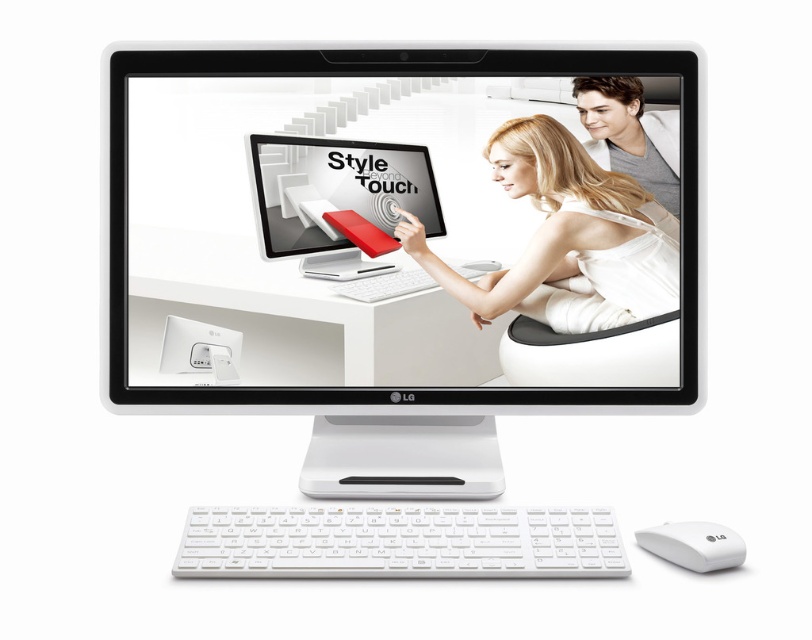
Describe the element at coordinates (400, 228) in the screenshot. I see `white glossy monitor at center` at that location.

Which is behind, point (417, 141) or point (433, 212)?

The point (433, 212) is behind.

The width and height of the screenshot is (812, 640). I want to click on white glossy monitor at center, so click(400, 228).

Does white glossy monitor at center have a greater width compared to smooth white shirt at upper right?

Yes.

Is white glossy monitor at center smaller than smooth white shirt at upper right?

No, white glossy monitor at center is not smaller than smooth white shirt at upper right.

Image resolution: width=812 pixels, height=640 pixels. I want to click on white glossy monitor at center, so click(400, 228).

Does white plastic keyboard at lower center have a larger size compared to smooth white shirt at upper right?

Yes.

Who is positioned more to the left, white plastic keyboard at lower center or smooth white shirt at upper right?

white plastic keyboard at lower center is more to the left.

Identify the location of white plastic keyboard at lower center. The height and width of the screenshot is (640, 812). (400, 541).

You are a GUI agent. You are given a task and a screenshot of the screen. Output one action in this format:
    pyautogui.click(x=<x>, y=<y>)
    Task: Click on the white plastic keyboard at lower center
    This screenshot has height=640, width=812.
    Given the screenshot: What is the action you would take?
    pyautogui.click(x=400, y=541)